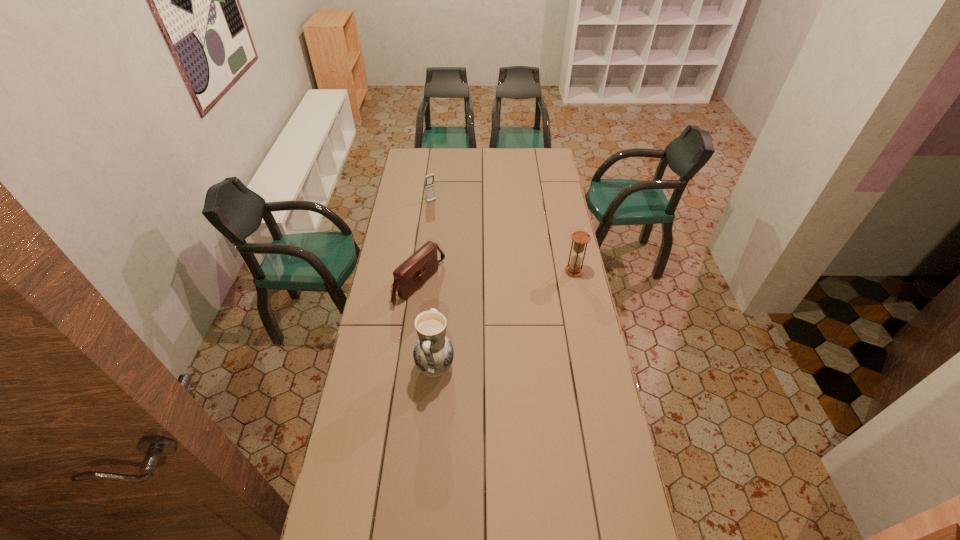
The image size is (960, 540). I want to click on vacant area at the right edge of the desktop, so click(x=600, y=384).

Where is `vacant position at the far left corner of the desktop`? This screenshot has width=960, height=540. vacant position at the far left corner of the desktop is located at coordinates (418, 150).

What are the coordinates of `empty space between the hourglass and the pottery` in the screenshot? It's located at (505, 319).

You are a GUI agent. You are given a task and a screenshot of the screen. Output one action in this format:
    pyautogui.click(x=<x>, y=<y>)
    Task: Click on the vacant space that's between the hourglass and the pottery
    
    Given the screenshot: What is the action you would take?
    pyautogui.click(x=505, y=319)

Where is `free spot between the rightmost object and the pottery`? free spot between the rightmost object and the pottery is located at coordinates [505, 319].

Identify the location of free spot between the cellular telephone and the shoulder bag. (425, 243).

At what (x,y) coordinates should I click in order to perform the action: click on free point between the shoulder bag and the rightmost object. Please return your answer as a coordinate pair (x, y). The height and width of the screenshot is (540, 960). Looking at the image, I should click on (496, 278).

Identify the location of unoccupied position between the farthest object and the shoulder bag. (425, 243).

Identify the location of vacant region between the farthest object and the tallest object. (433, 284).

Find the location of a particular element. This screenshot has height=540, width=960. object that can be found as the closest to the tallest object is located at coordinates (418, 268).